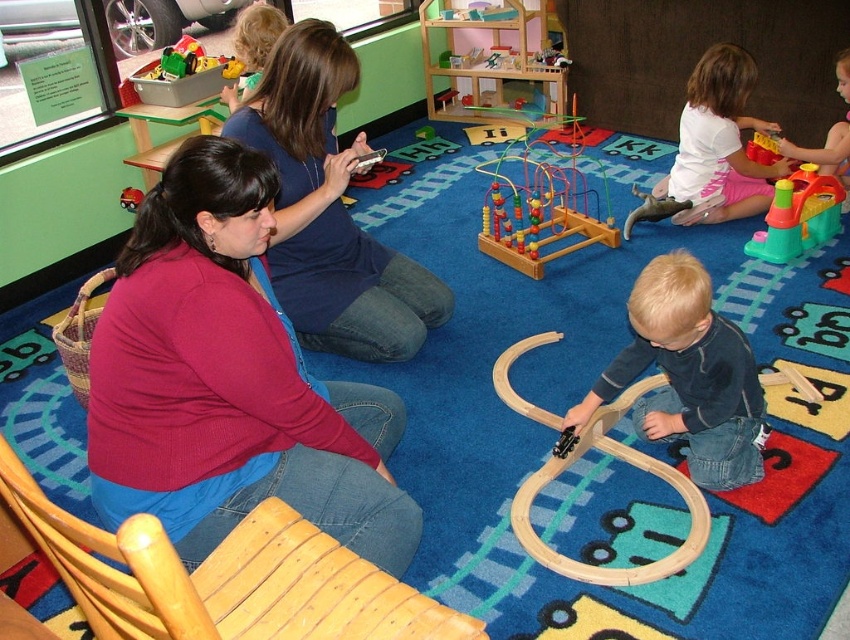
Which is above, green plastic train at upper left or smooth plastic toy at upper right?

green plastic train at upper left is higher up.

Is point (184, 99) more distant than point (848, 166)?

That is False.

Is point (222, 58) less distant than point (836, 154)?

No.

The width and height of the screenshot is (850, 640). What are the coordinates of `green plastic train at upper left` in the screenshot? It's located at (182, 76).

Based on the photo, which is more to the left, white matte toy at upper right or translucent green plastic toy at right?

white matte toy at upper right

Find the location of `white matte toy at upper right`. white matte toy at upper right is located at coordinates (718, 145).

Who is more distant from viewer, (752, 77) or (758, 243)?

Positioned behind is point (752, 77).

Locate an element on the screen. This screenshot has height=640, width=850. white matte toy at upper right is located at coordinates (718, 145).

Can you confirm if wooden dollhouse at center is smaller than wooden bead maze at center?

Indeed, wooden dollhouse at center has a smaller size compared to wooden bead maze at center.

How far apart are wooden dollhouse at center and wooden bead maze at center?

A distance of 20.96 inches exists between wooden dollhouse at center and wooden bead maze at center.

Who is more distant from viewer, [494,70] or [528,225]?

Point [494,70]

The height and width of the screenshot is (640, 850). In order to click on wooden dollhouse at center in this screenshot , I will do `click(490, 60)`.